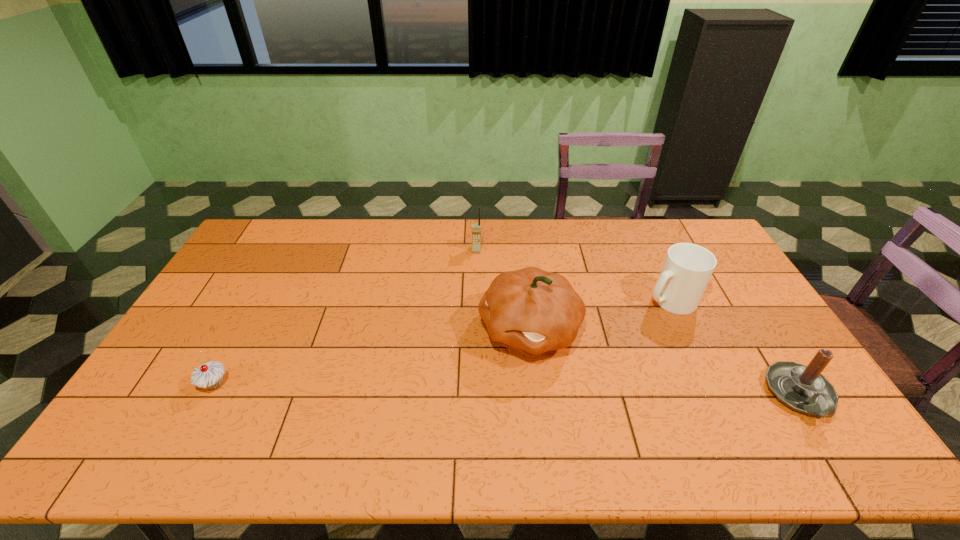
I want to click on the shortest object, so click(x=210, y=375).

This screenshot has width=960, height=540. I want to click on cupcake, so click(210, 375).

The image size is (960, 540). I want to click on the rightmost object, so click(803, 388).

Where is `mug`? mug is located at coordinates (687, 268).

Locate an element on the screen. The width and height of the screenshot is (960, 540). pumpkin is located at coordinates (530, 310).

Where is `cellular telephone`? This screenshot has height=540, width=960. cellular telephone is located at coordinates (476, 227).

What are the coordinates of `vacant area located 0.070m on the left of the leftmost object` in the screenshot? It's located at (173, 384).

Where is `free space located 0.320m on the handle side of the mug`? The image size is (960, 540). free space located 0.320m on the handle side of the mug is located at coordinates (585, 359).

Locate an element on the screen. The image size is (960, 540). blank space located 0.200m on the handle side of the mug is located at coordinates (612, 339).

In order to click on vacant space situated 0.150m on the handle side of the mug in this screenshot , I will do click(x=623, y=330).